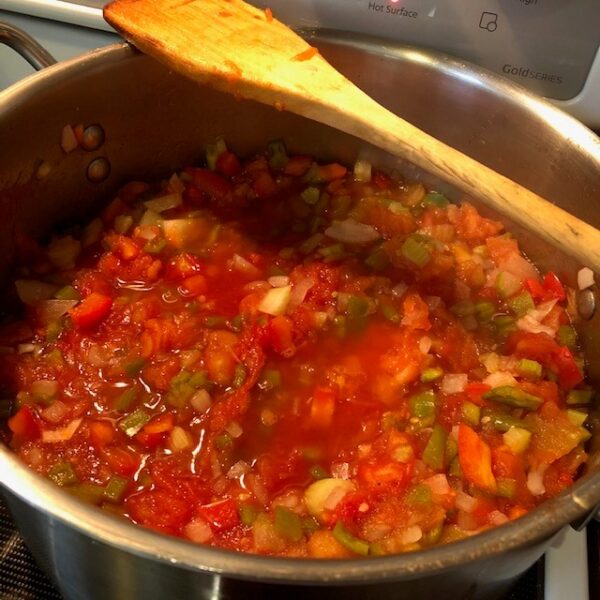
At what (x,y) coordinates should I click in order to perform the action: click on wooden spoon. Please return your answer as a coordinate pair (x, y). This screenshot has width=600, height=600. Looking at the image, I should click on (217, 39).